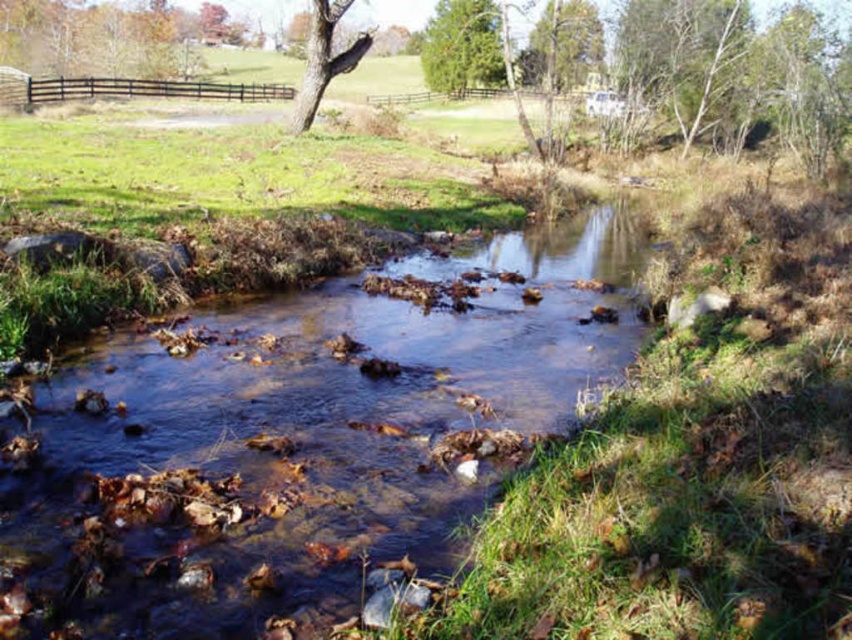
You are standing at the point labeled point (609, 348). You want to cross the stream to reach the other side. The stream is 10.30 meters wide at this point. If you have a 10 meter long rope, can you safely cross the stream using the rope?

The stream is 10.30 meters wide at this point, which is wider than the 10 meter long rope you have. Therefore, the rope is not long enough to safely cross the stream.

You are standing at the edge of the stream and see the point marked at coordinates (x=297, y=438). What is the color of the water at that point?

The point at coordinates (x=297, y=438) corresponds to translucent brown water at center.